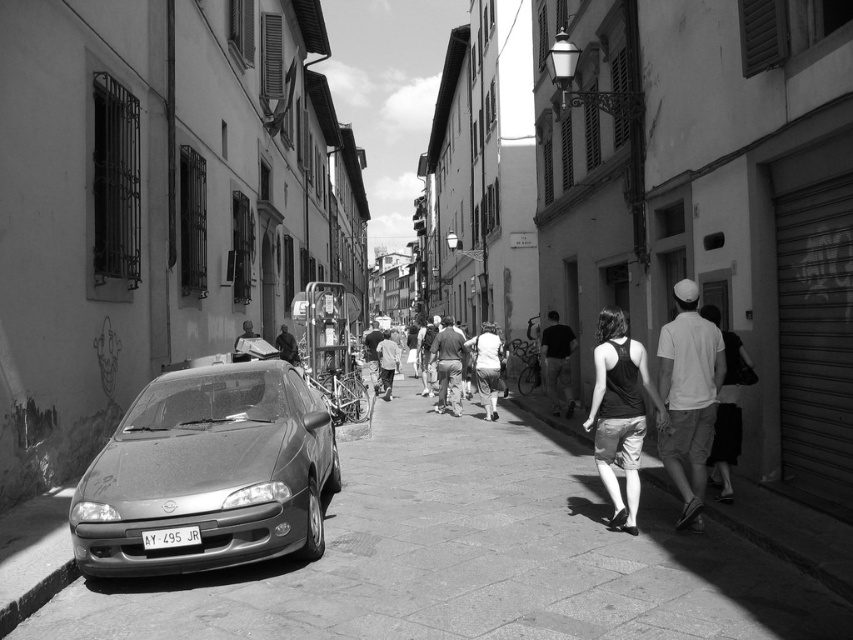
You are a delivery person standing on the smooth concrete pavement at lower left, and you need to place a package on the dark gray fabric jacket at center. Can you reach it without climbing onto anything?

The smooth concrete pavement at lower left has a lesser height compared to dark gray fabric jacket at center, so the dark gray fabric jacket at center is higher up. Therefore, you cannot reach it without climbing onto something.

You are a pedestrian standing on the cobblestone street in the historic area. You see a matte gray car at left and a dark gray fabric jacket at center. Which object is closer to you?

The dark gray fabric jacket at center is closer to you because the matte gray car at left is positioned under it.